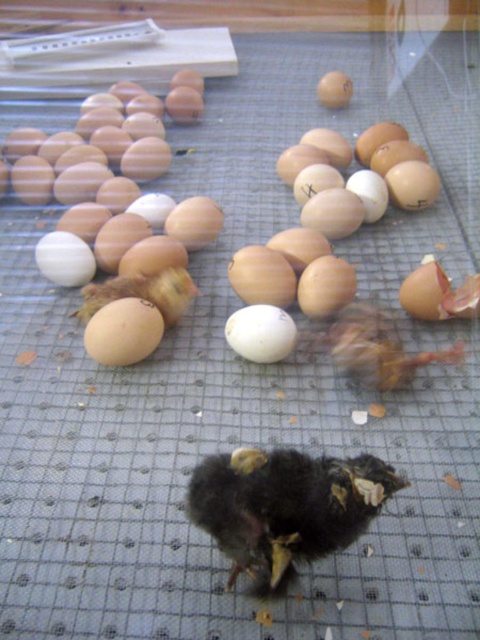
Question: Is brown matte egg at upper left positioned at the back of white matte egg at center?

Choices:
 (A) yes
 (B) no

Answer: (A)

Question: Which object appears closest to the camera in this image?

Choices:
 (A) brown matte egg at center
 (B) brown matte egg at upper left
 (C) brown fuzzy chick at center
 (D) matte brown egg at center

Answer: (D)

Question: Is brown matte egg at upper left below brown matte egg at center?

Choices:
 (A) no
 (B) yes

Answer: (A)

Question: Which point is farther from the camera taking this photo?

Choices:
 (A) click(x=145, y=307)
 (B) click(x=193, y=92)
 (C) click(x=255, y=314)

Answer: (B)

Question: Where is black downy chick at center located in relation to matte brown egg at center in the image?

Choices:
 (A) left
 (B) right

Answer: (B)

Question: Which object appears closest to the camera in this image?

Choices:
 (A) brown fuzzy chick at center
 (B) brown matte egg at center

Answer: (B)